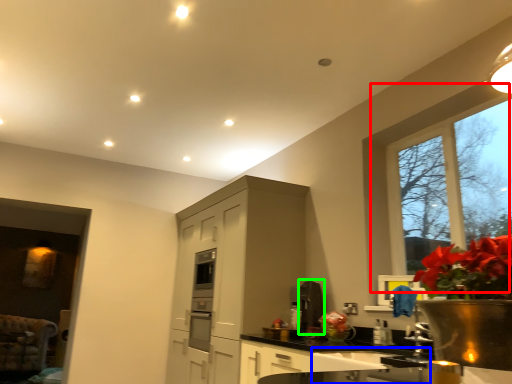
Question: Which object is positioned closest to window (highlighted by a red box)? Select from sink (highlighted by a blue box) and appliance (highlighted by a green box).

Choices:
 (A) sink
 (B) appliance

Answer: (B)